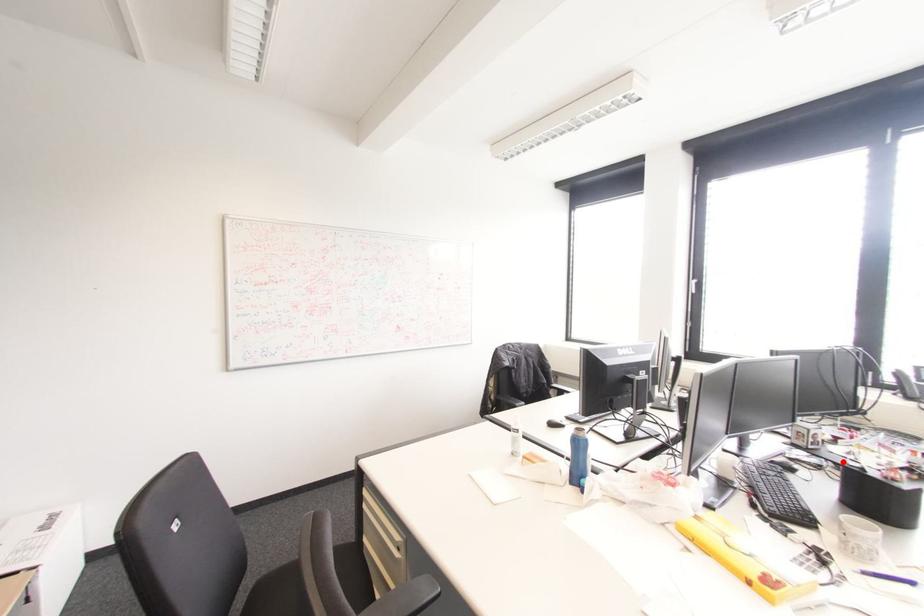
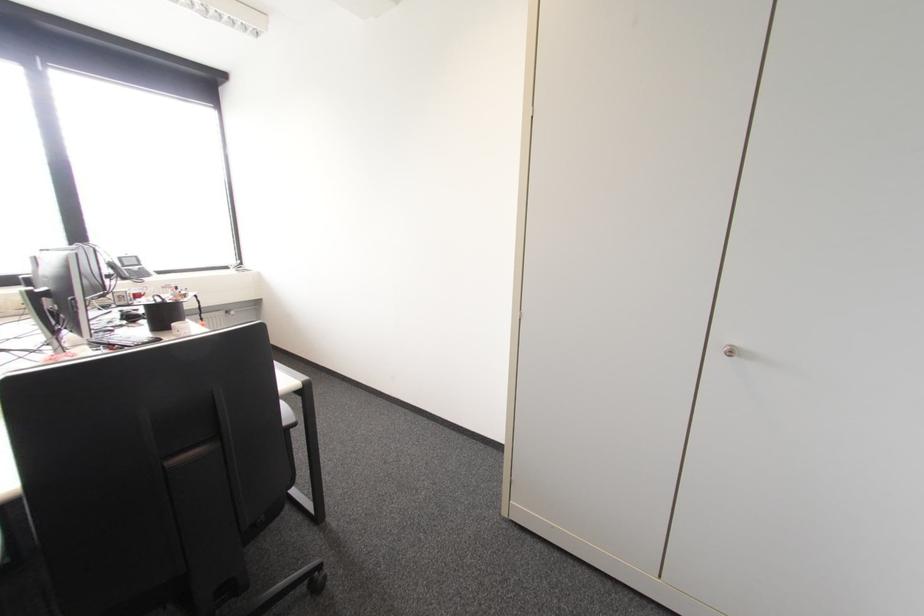
The point at the highlighted location is marked in the first image. Where is the corresponding point in the second image?

(148, 306)